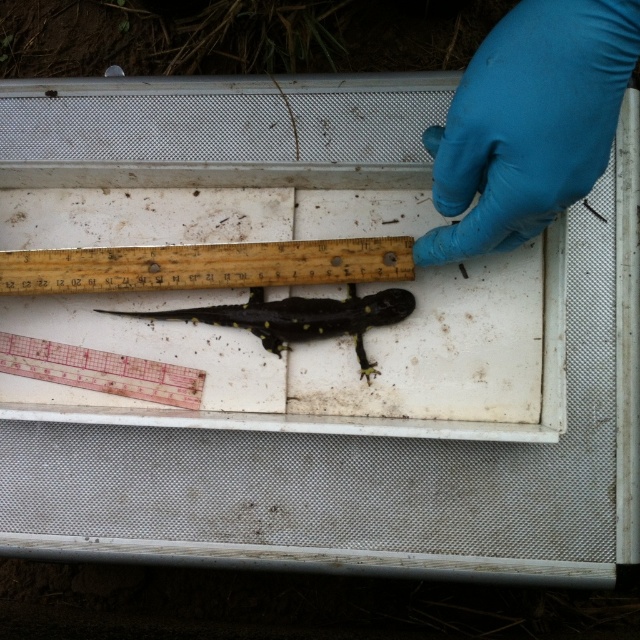
Is point (134, 288) closer to camera compared to point (13, 342)?

Yes, point (134, 288) is in front of point (13, 342).

Which is below, wooden ruler at center or transparent plastic ruler at lower left?

Positioned lower is transparent plastic ruler at lower left.

Is point (380, 244) farther from viewer compared to point (134, 360)?

No, (380, 244) is closer to viewer.

This screenshot has width=640, height=640. Identify the location of wooden ruler at center. (205, 266).

Does blue rubber glove at upper right appear on the left side of wooden ruler at center?

Incorrect, blue rubber glove at upper right is not on the left side of wooden ruler at center.

Between blue rubber glove at upper right and wooden ruler at center, which one is positioned higher?

blue rubber glove at upper right

Describe the element at coordinates (529, 124) in the screenshot. I see `blue rubber glove at upper right` at that location.

Locate an element on the screen. The image size is (640, 640). blue rubber glove at upper right is located at coordinates (529, 124).

Is blue rubber glove at upper right further to camera compared to transparent plastic ruler at lower left?

No, it is in front of transparent plastic ruler at lower left.

Can you confirm if blue rubber glove at upper right is positioned below transparent plastic ruler at lower left?

No, blue rubber glove at upper right is not below transparent plastic ruler at lower left.

Looking at this image, who is more distant from viewer, (x=513, y=51) or (x=76, y=364)?

The point (x=76, y=364) is more distant.

You are a GUI agent. You are given a task and a screenshot of the screen. Output one action in this format:
    pyautogui.click(x=<x>, y=<y>)
    Task: Click on the blue rubber glove at upper right
    The image size is (640, 640).
    Given the screenshot: What is the action you would take?
    [529, 124]